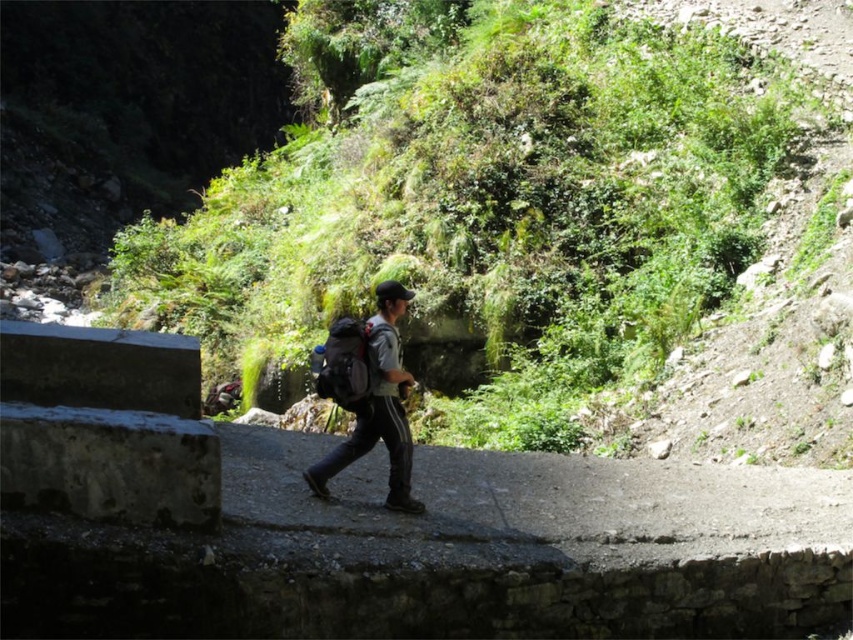
Which is behind, point (344, 323) or point (363, 364)?

The point (344, 323) is behind.

Is gray fabric backpack at center above matte gray backpack at center?

No, gray fabric backpack at center is not above matte gray backpack at center.

Is point (323, 396) farther from viewer compared to point (386, 332)?

That is True.

Identify the location of gray fabric backpack at center. This screenshot has height=640, width=853. (369, 396).

Does point (227, 353) come farther from viewer compared to point (334, 381)?

Yes.

Does green leafy vegetation at center appear under gray fabric backpack at center?

No, green leafy vegetation at center is not below gray fabric backpack at center.

This screenshot has width=853, height=640. What are the coordinates of `green leafy vegetation at center` in the screenshot? It's located at (502, 220).

Does green leafy vegetation at center have a greater height compared to matte gray backpack at center?

Correct, green leafy vegetation at center is much taller as matte gray backpack at center.

In the scene shown: Between green leafy vegetation at center and matte gray backpack at center, which one appears on the left side from the viewer's perspective?

Positioned to the left is matte gray backpack at center.

Is point (546, 61) more distant than point (347, 339)?

Yes, point (546, 61) is behind point (347, 339).

This screenshot has width=853, height=640. Find the location of `green leafy vegetation at center`. green leafy vegetation at center is located at coordinates (502, 220).